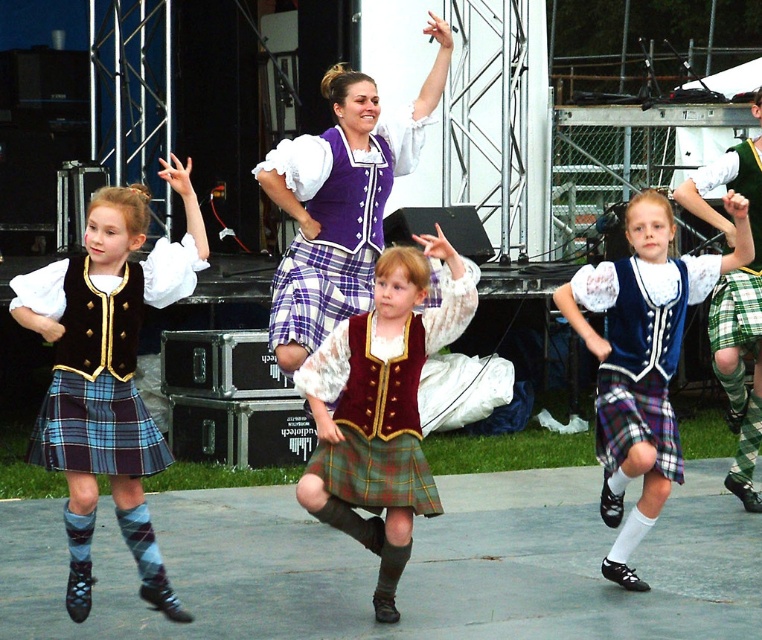
Question: Can you confirm if plaid wool kilt at center is positioned to the left of green plaid kilt at right?

Choices:
 (A) yes
 (B) no

Answer: (A)

Question: Estimate the real-world distances between objects in this image. Which object is farther from the purple satin dress at center?

Choices:
 (A) plaid wool kilt at center
 (B) green plaid kilt at right
 (C) blue plaid kilt at lower left

Answer: (B)

Question: Is green plaid kilt at right to the left of blue plaid kilt at lower left from the viewer's perspective?

Choices:
 (A) yes
 (B) no

Answer: (B)

Question: Is purple satin dress at center to the right of green plaid kilt at right from the viewer's perspective?

Choices:
 (A) yes
 (B) no

Answer: (B)

Question: Estimate the real-world distances between objects in this image. Which object is closer to the blue plaid kilt at lower left?

Choices:
 (A) blue velvet vest at center
 (B) purple satin dress at center
 (C) plaid wool kilt at center

Answer: (C)

Question: Which point is farther to the camera?

Choices:
 (A) (94, 285)
 (B) (165, 458)

Answer: (B)